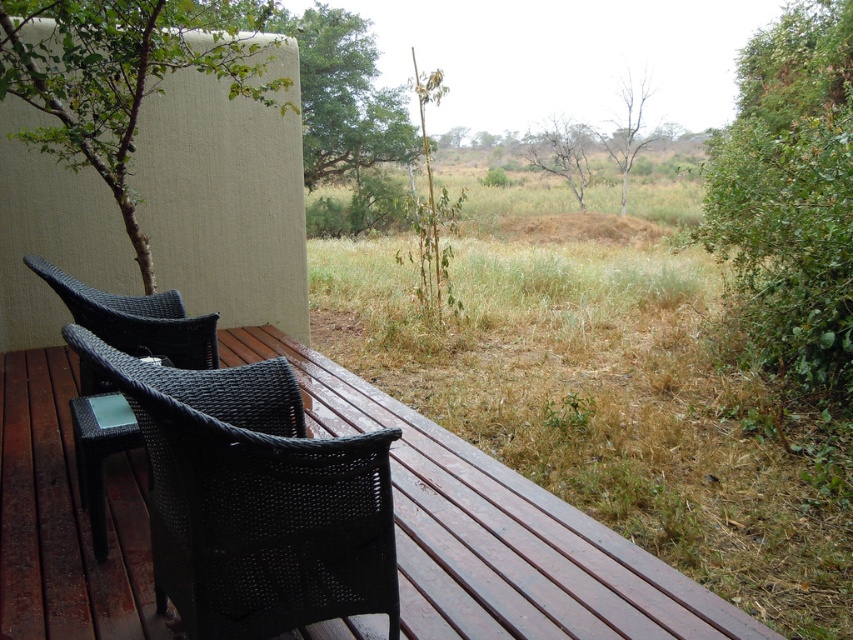
In the scene shown: You are standing on the brown wood deck at center and want to place a tall potted plant next to the black wicker chair at lower left. Based on their heights, will the plant be visible from the deck?

The brown wood deck at center is not as tall as black wicker chair at lower left, so the plant placed next to the black wicker chair at lower left will be visible from the deck since the chair is taller than the deck.

You are a guest staying at the safari lodge and want to place a large potted plant on the deck. The potted plant has a base that is wider than the deck. Which object in the scene would be a better fit for placing the potted plant, the brown wood deck at center or the green leafy bush at right?

The green leafy bush at right is wider than the brown wood deck at center, so the potted plant with a wide base would fit better on the green leafy bush at right.

You are planning to host a small gathering on the brown wood deck at center. Considering the size of the black wicker chair at lower left, do you think the deck can accommodate 10 such chairs comfortably?

The brown wood deck at center has a larger size compared to the black wicker chair at lower left. However, without knowing the exact dimensions of the deck or the chairs, it is impossible to determine if 10 chairs can fit comfortably. Additional information about the deck and chair sizes would be needed to make an accurate assessment.